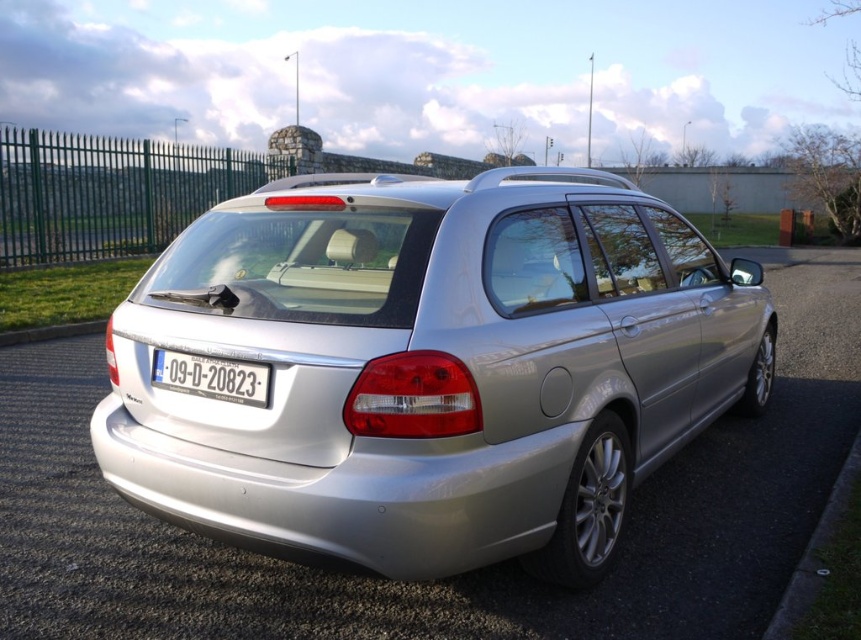
Question: Estimate the real-world distances between objects in this image. Which object is closer to the black asphalt curb at lower right?

Choices:
 (A) white plastic license plate at center
 (B) green metal fence at left

Answer: (A)

Question: Does silver metallic car at center appear on the left side of green metal fence at left?

Choices:
 (A) no
 (B) yes

Answer: (A)

Question: Is silver metallic car at center closer to camera compared to green metal fence at left?

Choices:
 (A) yes
 (B) no

Answer: (A)

Question: Which object appears farthest from the camera in this image?

Choices:
 (A) black asphalt curb at lower right
 (B) white plastic license plate at center

Answer: (B)

Question: Based on their relative distances, which object is farther from the black asphalt curb at lower right?

Choices:
 (A) silver metallic car at center
 (B) green metal fence at left
 (C) white plastic license plate at center

Answer: (B)

Question: Can you confirm if silver metallic car at center is positioned to the right of white plastic license plate at center?

Choices:
 (A) no
 (B) yes

Answer: (B)